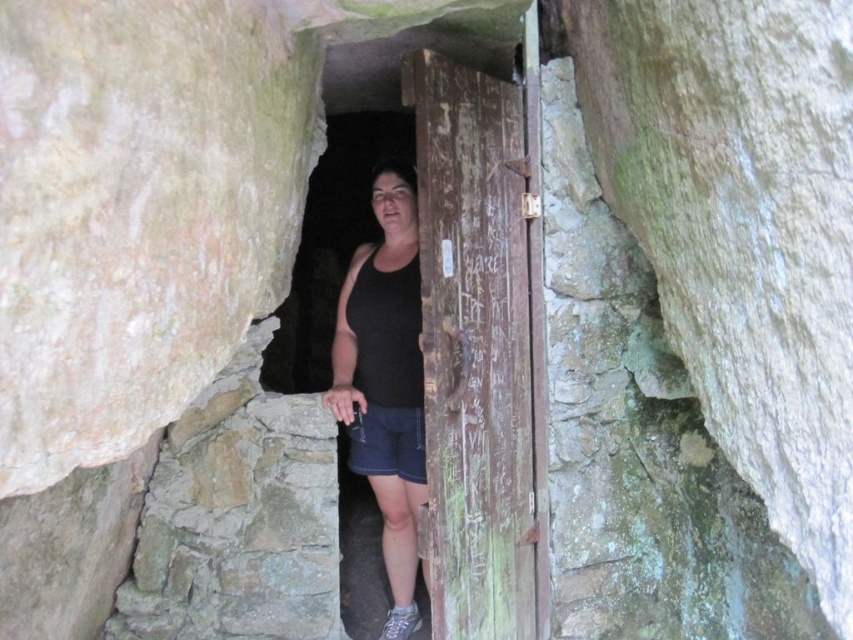
You are a photographer standing at the camera position. You want to capture a photo of the point at coordinates point (389, 188). The focus range of your camera is set to 8 feet. Will the point be in focus?

The distance of point (389, 188) from the camera is 8.25 feet, which is slightly beyond the camera focus range of 8 feet. Therefore, the point will not be in focus.

You are standing in front of the narrow stone doorway and want to reach the point marked at coordinates (401, 349). Can you estimate if you can comfortably reach that point without moving your position?

The point at coordinates (401, 349) is 2.47 meters away from the viewer. Since the average arm length is about 0.7 meters, you cannot comfortably reach that point without moving your position.

You are a fashion designer analyzing the clothing items in the image. Based on the scene description, which clothing item, the black matte tank top at center or the denim shorts at center, has a bigger size?

The black matte tank top at center has a larger size compared to the denim shorts at center.